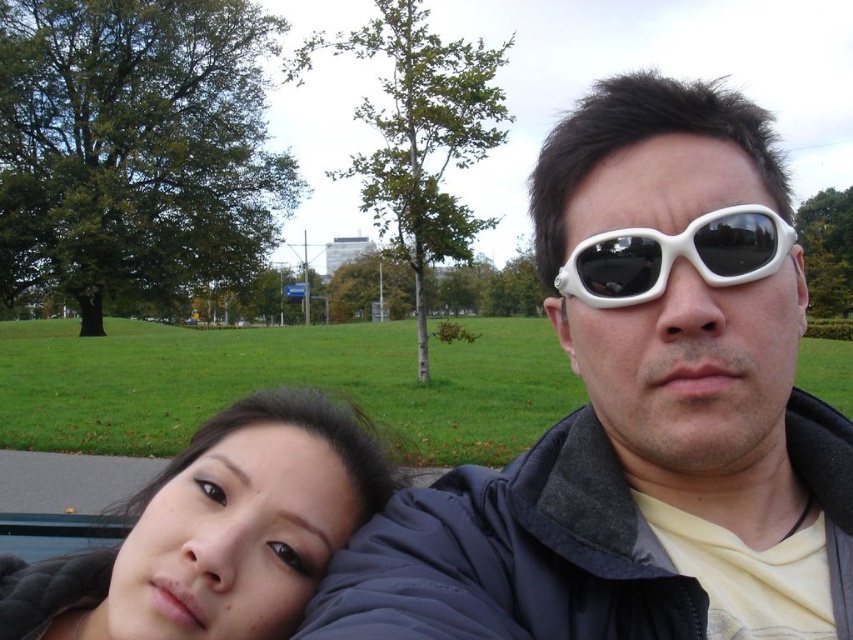
You are standing in the park and see the white plastic sunglasses at upper right. If you want to place a small marker exactly 10 cm to the left of the sunglasses, where would the marker be positioned relative to the person on the left?

The marker would be positioned to the left of the white plastic sunglasses at upper right, but since the sunglasses are on the person on the right, the marker would still be near the right side of the image, not near the person on the left.

You are standing in the park and see two people sitting on a bench. There is a point marked at coordinates (639, 413). What object is located at that point?

The point at coordinates (639, 413) marks the location of the white plastic sunglasses at upper right.

You are a photographer taking a portrait of the two people in the image. You want to ensure that the white plastic sunglasses at upper right and the smooth black hair at lower left are both visible in the frame. Based on their positions, do you think the sunglasses might be blocking the hair?

The white plastic sunglasses at upper right is positioned over smooth black hair at lower left, so the sunglasses are likely blocking part of the hair from view.